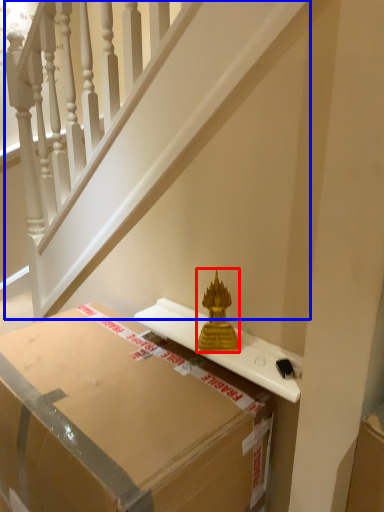
Question: Which point is further to the camera, sculpture (highlighted by a red box) or stairwell (highlighted by a blue box)?

Choices:
 (A) sculpture
 (B) stairwell

Answer: (A)